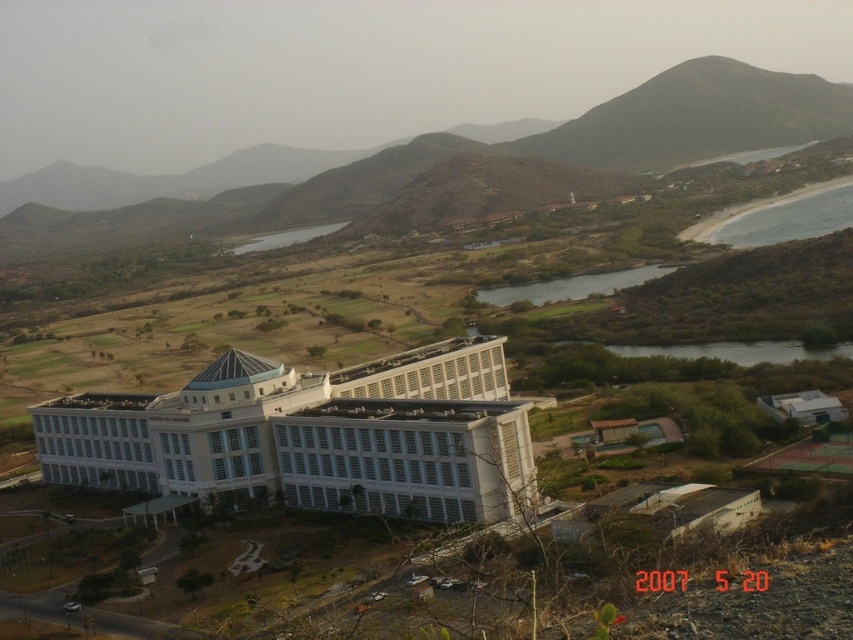
Question: Does white glass building at center lie in front of gray sand beach at lower right?

Choices:
 (A) no
 (B) yes

Answer: (B)

Question: Is white glass building at center below gray sand beach at lower right?

Choices:
 (A) no
 (B) yes

Answer: (B)

Question: In this image, where is white glass building at center located relative to gray sand beach at lower right?

Choices:
 (A) below
 (B) above

Answer: (A)

Question: Which of the following is the closest to the observer?

Choices:
 (A) (793, 227)
 (B) (503, 387)

Answer: (B)